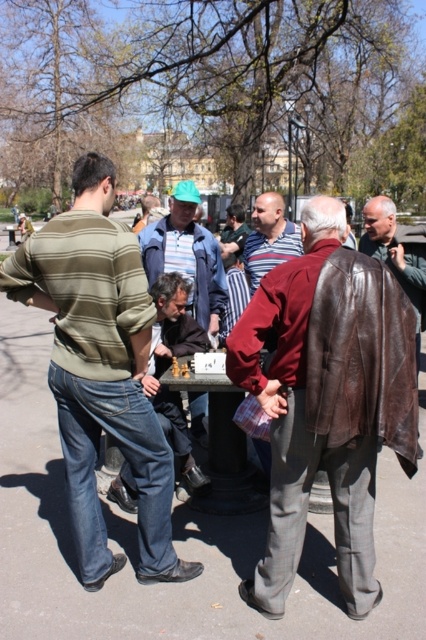
Is point (152, 332) closer to camera compared to point (227, 208)?

Yes, it is in front of point (227, 208).

Locate an element on the screen. Image resolution: width=426 pixels, height=640 pixels. dark brown leather jacket at center is located at coordinates (169, 364).

You are a GUI agent. You are given a task and a screenshot of the screen. Output one action in this format:
    pyautogui.click(x=<x>, y=<y>)
    Task: Click on the brown leather jacket at right
    Image resolution: width=426 pixels, height=640 pixels.
    Given the screenshot: What is the action you would take?
    pyautogui.click(x=396, y=256)

Between brown leather jacket at right and striped shirt at center, which one appears on the left side from the viewer's perspective?

From the viewer's perspective, striped shirt at center appears more on the left side.

Identify the location of brown leather jacket at right. This screenshot has width=426, height=640. (396, 256).

Locate an element on the screen. The width and height of the screenshot is (426, 640). brown leather jacket at right is located at coordinates (396, 256).

Does striped cotton shirt at left appear under wooden chessboard at center?

No.

Does striped cotton shirt at left have a greater width compared to wooden chessboard at center?

Yes, striped cotton shirt at left is wider than wooden chessboard at center.

Locate an element on the screen. striped cotton shirt at left is located at coordinates (100, 369).